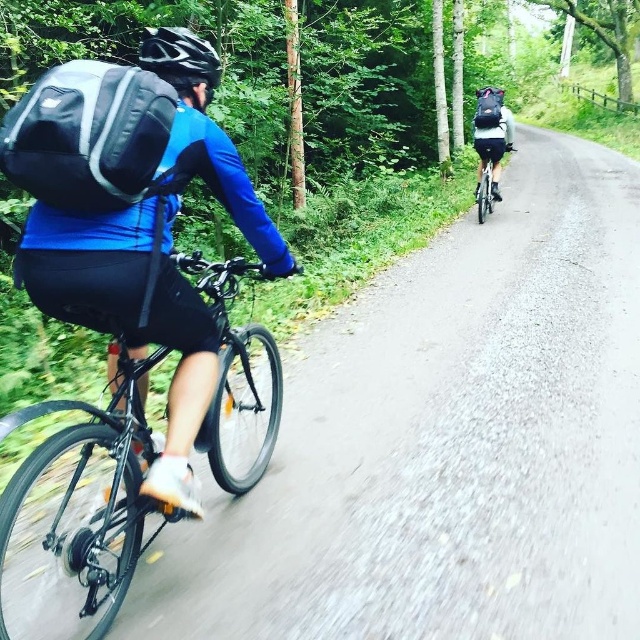
Question: Does black matte helmet at upper left lie in front of matte black backpack at upper right?

Choices:
 (A) yes
 (B) no

Answer: (A)

Question: Which object appears closest to the camera in this image?

Choices:
 (A) shiny black bicycle at left
 (B) matte black backpack at left
 (C) matte black backpack at upper right
 (D) black matte helmet at upper left

Answer: (A)

Question: Is black matte helmet at upper left smaller than shiny silver bicycle at right?

Choices:
 (A) no
 (B) yes

Answer: (B)

Question: Which of the following is the closest to the observer?

Choices:
 (A) shiny silver bicycle at right
 (B) shiny black bicycle at left
 (C) black matte helmet at upper left

Answer: (B)

Question: Which point is farther to the camera?

Choices:
 (A) matte black backpack at upper right
 (B) shiny silver bicycle at right
 (C) shiny black bicycle at left

Answer: (B)

Question: Is shiny black bicycle at left above black matte helmet at upper left?

Choices:
 (A) yes
 (B) no

Answer: (B)